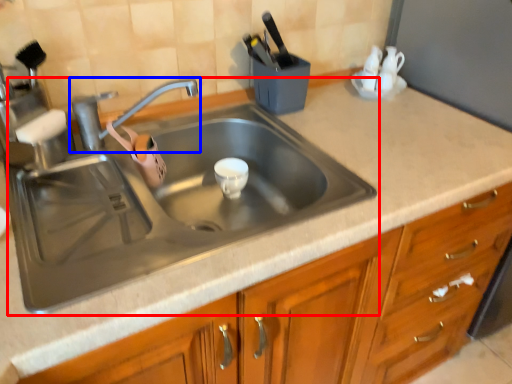
Question: Which object appears closest to the camera in this image, sink (highlighted by a red box) or tap (highlighted by a blue box)?

Choices:
 (A) sink
 (B) tap

Answer: (A)